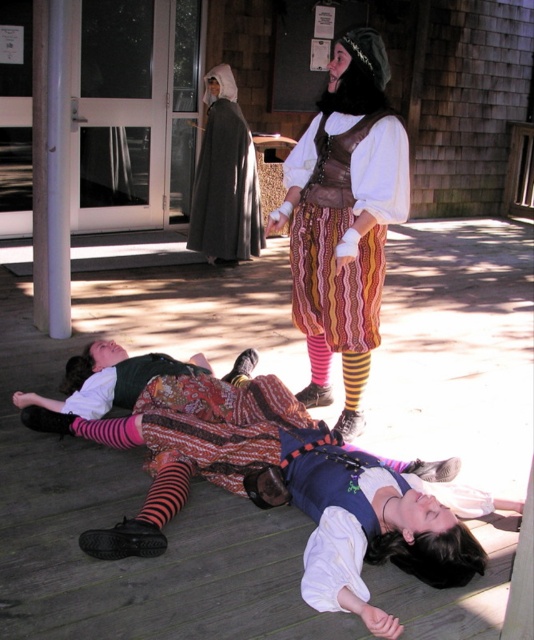
Between striped wool skirt at center and dark gray woolen cloak at center, which one appears on the left side from the viewer's perspective?

From the viewer's perspective, dark gray woolen cloak at center appears more on the left side.

Can you confirm if striped wool skirt at center is smaller than dark gray woolen cloak at center?

Indeed, striped wool skirt at center has a smaller size compared to dark gray woolen cloak at center.

Is point (405, 140) positioned before point (211, 104)?

Yes.

Where is `striped wool skirt at center`? The width and height of the screenshot is (534, 640). striped wool skirt at center is located at coordinates (345, 196).

Is striped wool skirt at center shorter than black striped sock at center?

Incorrect, striped wool skirt at center's height does not fall short of black striped sock at center's.

Is striped wool skirt at center thinner than black striped sock at center?

Incorrect, striped wool skirt at center's width is not less than black striped sock at center's.

Does point (270, 212) come closer to viewer compared to point (344, 404)?

That is True.

Where is `striped wool skirt at center`? This screenshot has width=534, height=640. striped wool skirt at center is located at coordinates [345, 196].

Does striped wool skirt at center appear over pink striped sock at lower center?

Yes, striped wool skirt at center is above pink striped sock at lower center.

Which is more to the right, striped wool skirt at center or pink striped sock at lower center?

pink striped sock at lower center is more to the right.

Is point (292, 278) in front of point (318, 381)?

That is False.

At what (x,y) coordinates should I click in order to perform the action: click on striped wool skirt at center. Please return your answer as a coordinate pair (x, y). Looking at the image, I should click on (345, 196).